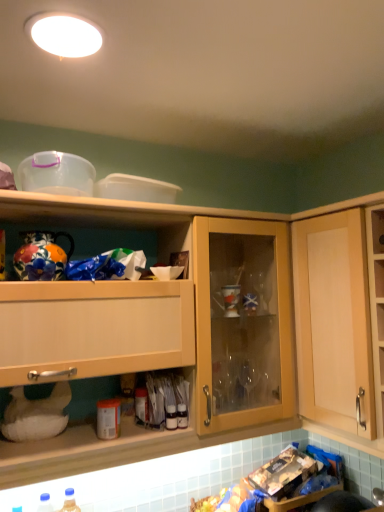
Image resolution: width=384 pixels, height=512 pixels. What do you see at coordinates (333, 321) in the screenshot?
I see `light wood cabinet at right, marked as the first cabinetry in a right-to-left arrangement` at bounding box center [333, 321].

Identify the location of translucent plastic bottle at center, which is the second bottle from top to bottom. (171, 417).

What do you see at coordinates (141, 403) in the screenshot? The image size is (384, 512). I see `matte plastic bottle at center, acting as the 2th bottle starting from the left` at bounding box center [141, 403].

In order to click on light wood cabinet at right, marked as the first cabinetry in a right-to-left arrangement in this screenshot , I will do `click(333, 321)`.

Which point is more forward, (64, 42) or (61, 438)?

Positioned in front is point (64, 42).

In the scene shown: Between white glossy light fixture at upper center and wooden cabinet at upper center, arranged as the first cabinetry when viewed from the left, which one is positioned in front?

white glossy light fixture at upper center.

Identify the location of lighting above the wooden cabinet at upper center, arranged as the first cabinetry when viewed from the left (from the image's perspective). (66, 36).

Is matte plastic bottle at center, which is counted as the first bottle, starting from the top, next to white glossy light fixture at upper center and touching it?

matte plastic bottle at center, which is counted as the first bottle, starting from the top, is not next to white glossy light fixture at upper center, and they're not touching.

From the image's perspective, is matte plastic bottle at center, positioned as the 3th bottle in bottom-to-top order, on top of white glossy light fixture at upper center?

Actually, matte plastic bottle at center, positioned as the 3th bottle in bottom-to-top order, appears below white glossy light fixture at upper center in the image.

Looking at this image, is matte plastic bottle at center, which is counted as the first bottle, starting from the top, shorter than white glossy light fixture at upper center?

Answer: No, matte plastic bottle at center, which is counted as the first bottle, starting from the top, is not shorter than white glossy light fixture at upper center.

This screenshot has height=512, width=384. Identify the location of lighting on the left of matte plastic bottle at center, positioned as the 3th bottle in bottom-to-top order. (66, 36).

Which point is more forward, (173,422) or (49,27)?

Point (49,27)

From the image's perspective, is translucent plastic bottle at center, which is the second bottle from top to bottom, over white glossy light fixture at upper center?

Actually, translucent plastic bottle at center, which is the second bottle from top to bottom, appears below white glossy light fixture at upper center in the image.

Is translucent plastic bottle at center, which appears as the first bottle when viewed from the right, aimed at white glossy light fixture at upper center?

No, translucent plastic bottle at center, which appears as the first bottle when viewed from the right, does not turn towards white glossy light fixture at upper center.

Would you say translucent plastic bottle at center, which appears as the first bottle when viewed from the right, is to the left or to the right of white glossy light fixture at upper center in the picture?

Clearly, translucent plastic bottle at center, which appears as the first bottle when viewed from the right, is on the right of white glossy light fixture at upper center in the image.

Who is taller, white glossy light fixture at upper center or blue plastic bottle at lower left, the third bottle positioned from the top?

Standing taller between the two is blue plastic bottle at lower left, the third bottle positioned from the top.

From the image's perspective, is white glossy light fixture at upper center over blue plastic bottle at lower left, the 1th bottle from the bottom?

Yes.

Are white glossy light fixture at upper center and blue plastic bottle at lower left, which is the 1th bottle in left-to-right order, making contact?

No, white glossy light fixture at upper center is not in contact with blue plastic bottle at lower left, which is the 1th bottle in left-to-right order.

From a real-world perspective, between white glossy light fixture at upper center and blue plastic bottle at lower left, the 1th bottle from the bottom, who is vertically lower?

From a 3D spatial view, blue plastic bottle at lower left, the 1th bottle from the bottom, is below.

Is wooden cabinet at upper center, which appears as the second cabinetry when viewed from the right, at the left side of translucent plastic bottle at center, positioned as the second bottle in bottom-to-top order?

Correct, you'll find wooden cabinet at upper center, which appears as the second cabinetry when viewed from the right, to the left of translucent plastic bottle at center, positioned as the second bottle in bottom-to-top order.

Based on the photo, can you confirm if wooden cabinet at upper center, arranged as the first cabinetry when viewed from the left, is smaller than translucent plastic bottle at center, which appears as the first bottle when viewed from the right?

No.

Is wooden cabinet at upper center, which appears as the second cabinetry when viewed from the right, positioned with its back to translucent plastic bottle at center, which is the second bottle from top to bottom?

Yes, wooden cabinet at upper center, which appears as the second cabinetry when viewed from the right, is positioned with its back facing translucent plastic bottle at center, which is the second bottle from top to bottom.

Locate an element on the screen. This screenshot has width=384, height=512. bottle above the translucent plastic bottle at center, which appears as the first bottle when viewed from the right (from a real-world perspective) is located at coordinates (141, 403).

Is translucent plastic bottle at center, which appears as the first bottle when viewed from the right, touching matte plastic bottle at center, which is counted as the first bottle, starting from the top?

No, translucent plastic bottle at center, which appears as the first bottle when viewed from the right, is not in contact with matte plastic bottle at center, which is counted as the first bottle, starting from the top.

From a real-world perspective, is translucent plastic bottle at center, which appears as the first bottle when viewed from the right, positioned above or below matte plastic bottle at center, acting as the 2th bottle starting from the left?

translucent plastic bottle at center, which appears as the first bottle when viewed from the right, is situated lower than matte plastic bottle at center, acting as the 2th bottle starting from the left, in the real world.

Is matte plastic bottle at center, which is counted as the first bottle, starting from the top, at the back of translucent plastic bottle at center, arranged as the 3th bottle when viewed from the left?

No.

How much distance is there between wooden cabinet at upper center, which appears as the second cabinetry when viewed from the right, and white glossy light fixture at upper center?

wooden cabinet at upper center, which appears as the second cabinetry when viewed from the right, and white glossy light fixture at upper center are 74.28 centimeters apart from each other.

Is point (173, 449) positioned in front of point (95, 45)?

No, it is not.

Considering the relative sizes of wooden cabinet at upper center, which appears as the second cabinetry when viewed from the right, and white glossy light fixture at upper center in the image provided, is wooden cabinet at upper center, which appears as the second cabinetry when viewed from the right, wider than white glossy light fixture at upper center?

Indeed, wooden cabinet at upper center, which appears as the second cabinetry when viewed from the right, has a greater width compared to white glossy light fixture at upper center.

Who is more distant, wooden cabinet at upper center, which appears as the second cabinetry when viewed from the right, or white glossy light fixture at upper center?

wooden cabinet at upper center, which appears as the second cabinetry when viewed from the right.

This screenshot has height=512, width=384. I want to click on lighting in front of the wooden cabinet at upper center, arranged as the first cabinetry when viewed from the left, so click(x=66, y=36).

In order to click on lighting above the matte plastic bottle at center, acting as the 2th bottle starting from the left (from a real-world perspective) in this screenshot , I will do `click(66, 36)`.

Which object lies nearer to the anchor point matte plastic bottle at center, acting as the 2th bottle starting from the left, white glossy light fixture at upper center or light wood cabinet at right, marked as the first cabinetry in a right-to-left arrangement?

light wood cabinet at right, marked as the first cabinetry in a right-to-left arrangement, lies closer to matte plastic bottle at center, acting as the 2th bottle starting from the left, than the other object.

When comparing their distances from matte plastic bottle at center, acting as the 2th bottle starting from the left, does wooden cabinet at upper center, arranged as the first cabinetry when viewed from the left, or translucent plastic bottle at center, arranged as the 3th bottle when viewed from the left, seem further?

Based on the image, wooden cabinet at upper center, arranged as the first cabinetry when viewed from the left, appears to be further to matte plastic bottle at center, acting as the 2th bottle starting from the left.

From the image, which object appears to be farther from wooden cabinet at upper center, which appears as the second cabinetry when viewed from the right, white glossy light fixture at upper center or matte plastic bottle at center, which is the 2th bottle from right to left?

Based on the image, white glossy light fixture at upper center appears to be further to wooden cabinet at upper center, which appears as the second cabinetry when viewed from the right.

From the image, which object appears to be farther from white glossy light fixture at upper center, wooden cabinet at upper center, which appears as the second cabinetry when viewed from the right, or light wood cabinet at right, the second cabinetry positioned from the left?

Among the two, light wood cabinet at right, the second cabinetry positioned from the left, is located further to white glossy light fixture at upper center.

From the image, which object appears to be farther from matte plastic bottle at center, acting as the 2th bottle starting from the left, light wood cabinet at right, marked as the first cabinetry in a right-to-left arrangement, or translucent plastic bottle at center, which is the second bottle from top to bottom?

light wood cabinet at right, marked as the first cabinetry in a right-to-left arrangement.

From the image, which object appears to be nearer to translucent plastic bottle at center, arranged as the 3th bottle when viewed from the left, matte plastic bottle at center, positioned as the 3th bottle in bottom-to-top order, or white glossy light fixture at upper center?

matte plastic bottle at center, positioned as the 3th bottle in bottom-to-top order, is closer to translucent plastic bottle at center, arranged as the 3th bottle when viewed from the left.

From the image, which object appears to be nearer to matte plastic bottle at center, positioned as the 3th bottle in bottom-to-top order, white glossy light fixture at upper center or translucent plastic bottle at center, positioned as the second bottle in bottom-to-top order?

translucent plastic bottle at center, positioned as the second bottle in bottom-to-top order, lies closer to matte plastic bottle at center, positioned as the 3th bottle in bottom-to-top order, than the other object.

Estimate the real-world distances between objects in this image. Which object is closer to matte plastic bottle at center, acting as the 2th bottle starting from the left, blue plastic bottle at lower left, which ranks as the third bottle in right-to-left order, or translucent plastic bottle at center, arranged as the 3th bottle when viewed from the left?

Among the two, translucent plastic bottle at center, arranged as the 3th bottle when viewed from the left, is located nearer to matte plastic bottle at center, acting as the 2th bottle starting from the left.

At what (x,y) coordinates should I click in order to perform the action: click on bottle between matte plastic bottle at center, positioned as the 3th bottle in bottom-to-top order, and light wood cabinet at right, the second cabinetry positioned from the left, in the horizontal direction. Please return your answer as a coordinate pair (x, y). This screenshot has height=512, width=384. Looking at the image, I should click on (171, 417).

At what (x,y) coordinates should I click in order to perform the action: click on cabinetry situated between matte plastic bottle at center, acting as the 2th bottle starting from the left, and light wood cabinet at right, marked as the first cabinetry in a right-to-left arrangement, from left to right. Please return your answer as a coordinate pair (x, y). This screenshot has width=384, height=512. Looking at the image, I should click on (126, 355).

The image size is (384, 512). I want to click on cabinetry between blue plastic bottle at lower left, the third bottle positioned from the top, and light wood cabinet at right, marked as the first cabinetry in a right-to-left arrangement, so click(126, 355).

Where is `bottle located between wooden cabinet at upper center, arranged as the first cabinetry when viewed from the left, and light wood cabinet at right, marked as the first cabinetry in a right-to-left arrangement, in the left-right direction`? This screenshot has width=384, height=512. bottle located between wooden cabinet at upper center, arranged as the first cabinetry when viewed from the left, and light wood cabinet at right, marked as the first cabinetry in a right-to-left arrangement, in the left-right direction is located at coordinates (171, 417).